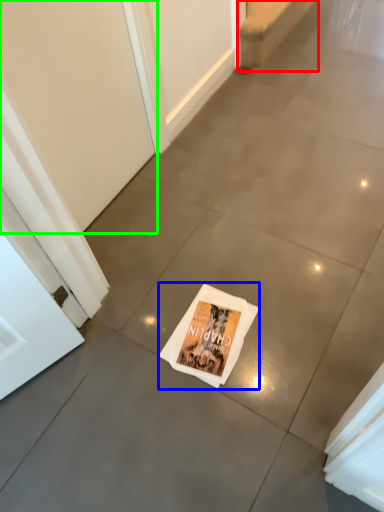
Question: Which object is the farthest from stairwell (highlighted by a red box)? Choose among these: magazine (highlighted by a blue box) or screen door (highlighted by a green box).

Choices:
 (A) magazine
 (B) screen door

Answer: (A)